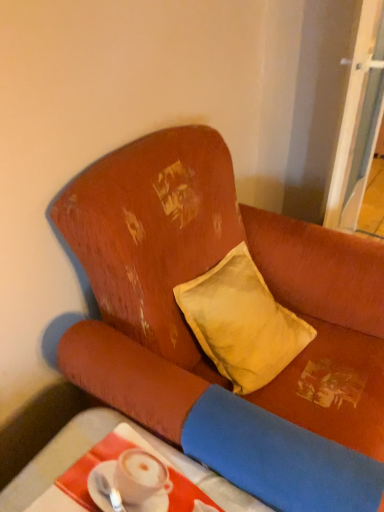
Question: Does white glossy spoon at lower left have a lesser width compared to distressed orange fabric couch at upper left?

Choices:
 (A) yes
 (B) no

Answer: (A)

Question: Does white glossy spoon at lower left have a greater height compared to distressed orange fabric couch at upper left?

Choices:
 (A) no
 (B) yes

Answer: (A)

Question: Is white glossy spoon at lower left surrounding distressed orange fabric couch at upper left?

Choices:
 (A) no
 (B) yes

Answer: (A)

Question: Considering the relative sizes of white glossy spoon at lower left and distressed orange fabric couch at upper left in the image provided, is white glossy spoon at lower left bigger than distressed orange fabric couch at upper left?

Choices:
 (A) yes
 (B) no

Answer: (B)

Question: Are white glossy spoon at lower left and distressed orange fabric couch at upper left far apart?

Choices:
 (A) no
 (B) yes

Answer: (A)

Question: Does white glossy spoon at lower left have a smaller size compared to distressed orange fabric couch at upper left?

Choices:
 (A) no
 (B) yes

Answer: (B)

Question: Can you confirm if distressed orange fabric couch at upper left is positioned to the left of smooth white table at lower left?

Choices:
 (A) no
 (B) yes

Answer: (A)

Question: Does distressed orange fabric couch at upper left have a smaller size compared to smooth white table at lower left?

Choices:
 (A) no
 (B) yes

Answer: (A)

Question: Is distressed orange fabric couch at upper left to the right of smooth white table at lower left from the viewer's perspective?

Choices:
 (A) yes
 (B) no

Answer: (A)

Question: Are distressed orange fabric couch at upper left and smooth white table at lower left far apart?

Choices:
 (A) no
 (B) yes

Answer: (A)

Question: From a real-world perspective, is distressed orange fabric couch at upper left over smooth white table at lower left?

Choices:
 (A) no
 (B) yes

Answer: (B)

Question: Is distressed orange fabric couch at upper left thinner than smooth white table at lower left?

Choices:
 (A) yes
 (B) no

Answer: (B)

Question: From a real-world perspective, is white glossy spoon at lower left on top of transparent glass screen door at upper right?

Choices:
 (A) no
 (B) yes

Answer: (A)